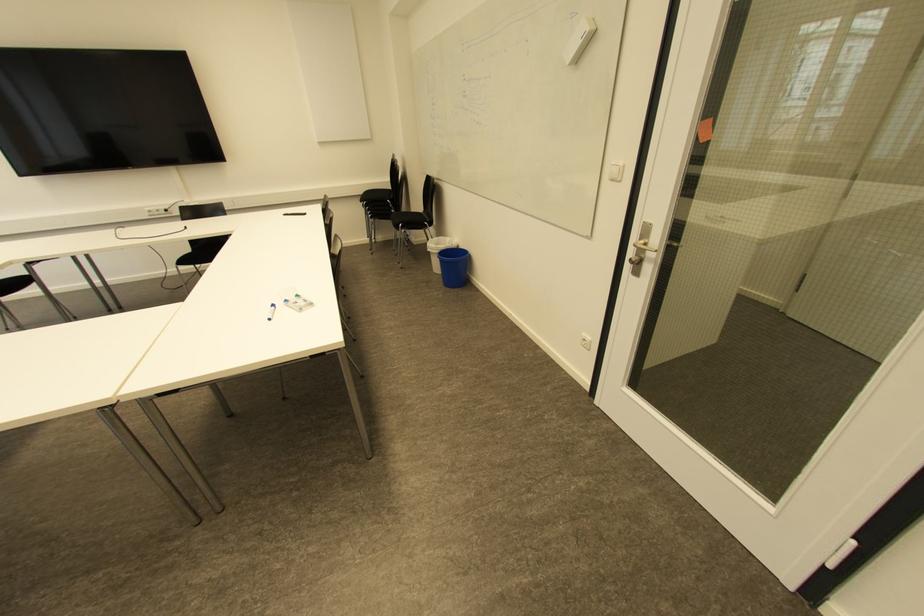
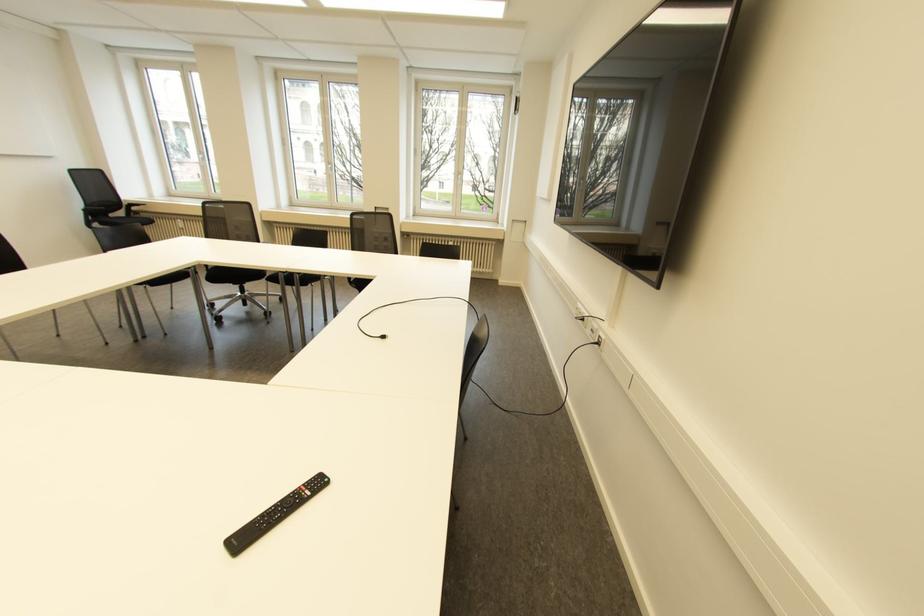
Question: I am providing you with two images of the same scene from different viewpoints. After the viewpoint changes to image2, which objects are now occluded?

Choices:
 (A) white power socket
 (B) hairbrush handle
 (C) black chair armrest
 (D) black chair sitting surface

Answer: (D)